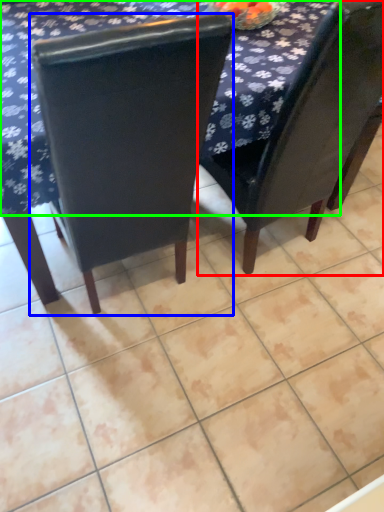
Question: Based on their relative distances, which object is nearer to chair (highlighted by a red box)? Choose from chair (highlighted by a blue box) and tablecloth (highlighted by a green box).

Choices:
 (A) chair
 (B) tablecloth

Answer: (B)